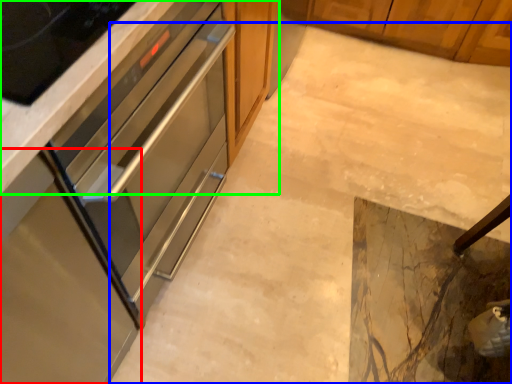
Question: Which object is positioned farthest from cabinetry (highlighted by a red box)? Select from concrete (highlighted by a blue box) and cabinetry (highlighted by a green box).

Choices:
 (A) concrete
 (B) cabinetry

Answer: (A)